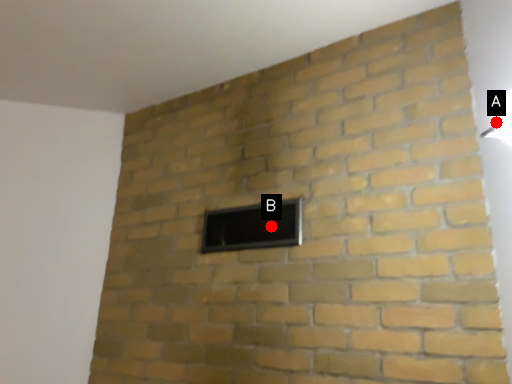
Question: Two points are circled on the image, labeled by A and B beside each circle. Among these points, which one is farthest from the camera?

Choices:
 (A) A is further
 (B) B is further

Answer: (B)